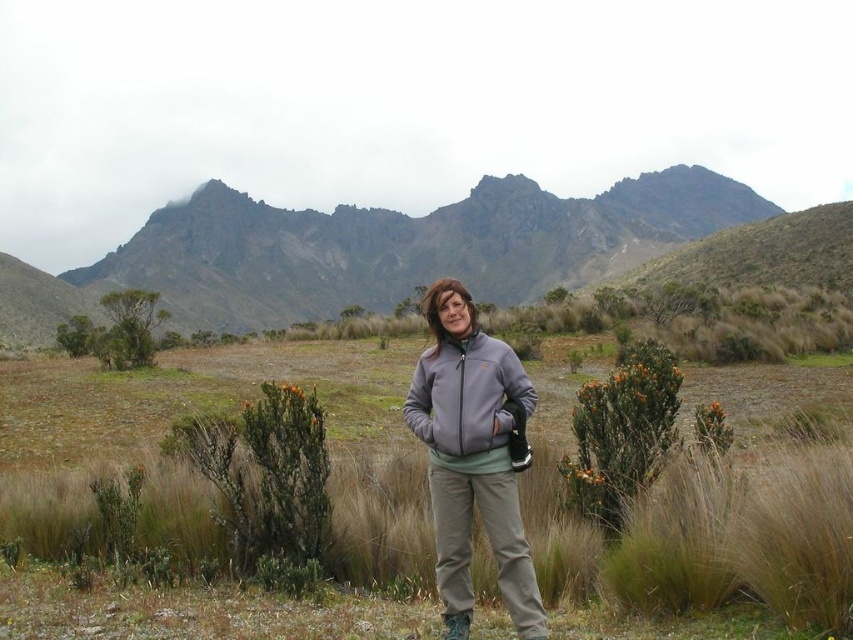
Between point (517, 490) and point (480, 349), which one is positioned in front?

Point (517, 490)

Between point (456, 403) and point (514, 385), which one is positioned behind?

The point (514, 385) is more distant.

Find the location of `gray fleece jacket at center`. gray fleece jacket at center is located at coordinates [473, 458].

In the scene shown: Does brown dry grass at center appear on the left side of gray fleece sweatshirt at center?

Correct, you'll find brown dry grass at center to the left of gray fleece sweatshirt at center.

Is brown dry grass at center further to camera compared to gray fleece sweatshirt at center?

No, brown dry grass at center is in front of gray fleece sweatshirt at center.

Find the location of `brown dry grass at center`. brown dry grass at center is located at coordinates (708, 534).

Between brown dry grass at center and gray fleece jacket at center, which one has less height?

brown dry grass at center

Can you confirm if brown dry grass at center is smaller than gray fleece jacket at center?

No, brown dry grass at center is not smaller than gray fleece jacket at center.

Describe the element at coordinates (708, 534) in the screenshot. The height and width of the screenshot is (640, 853). I see `brown dry grass at center` at that location.

At what (x,y) coordinates should I click in order to perform the action: click on brown dry grass at center. Please return your answer as a coordinate pair (x, y). The height and width of the screenshot is (640, 853). Looking at the image, I should click on (708, 534).